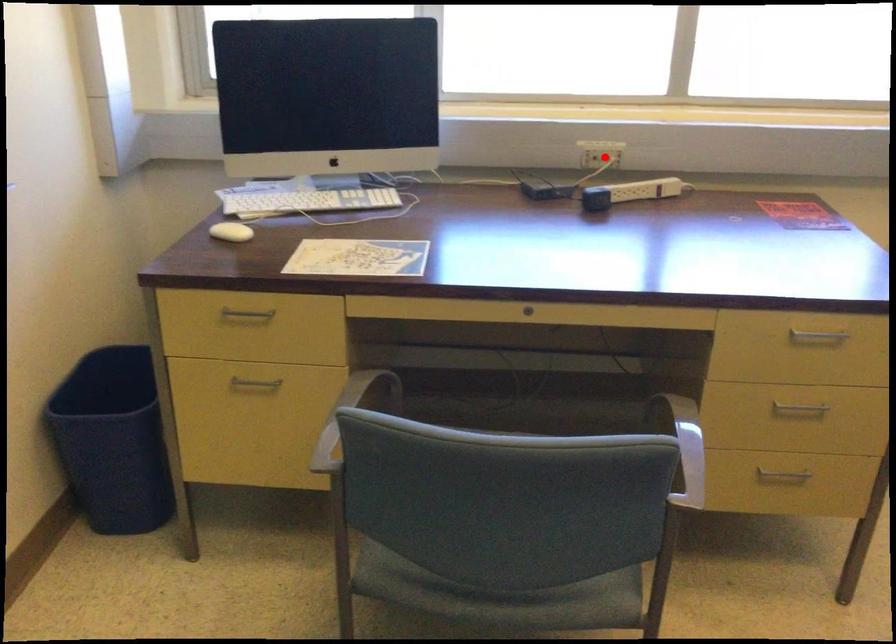
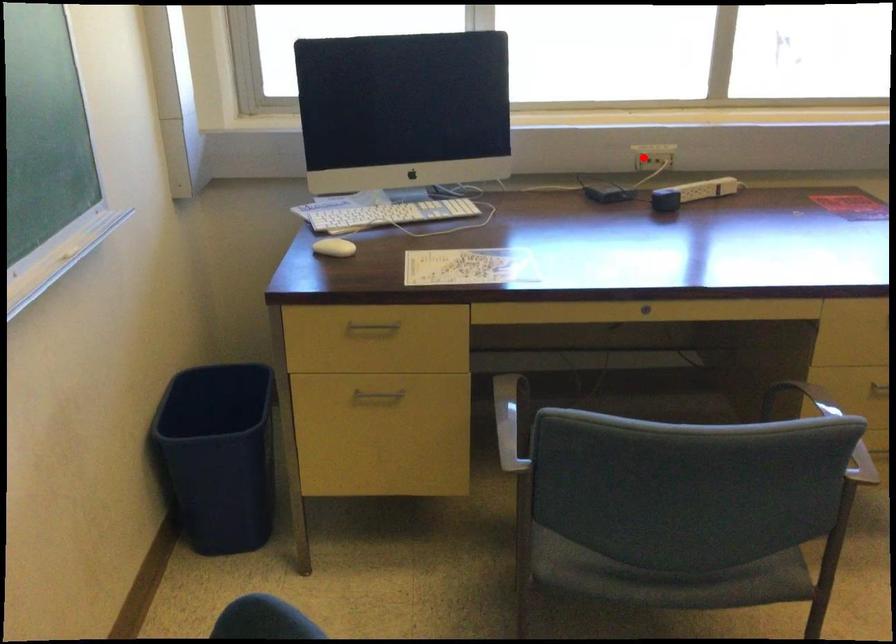
I am providing you with two images of the same scene from different viewpoints. A red point is marked on the first image and another point is marked on the second image. Is the marked point in image1 the same physical position as the marked point in image2?

No